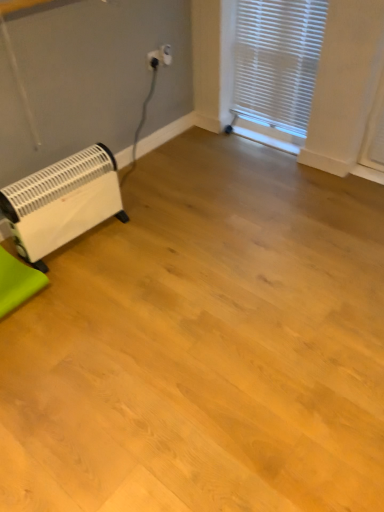
Question: Does green fabric at lower left turn towards white plastic heater at lower left?

Choices:
 (A) no
 (B) yes

Answer: (A)

Question: Does green fabric at lower left have a lesser width compared to white plastic heater at lower left?

Choices:
 (A) no
 (B) yes

Answer: (A)

Question: Is white plastic heater at lower left at the back of green fabric at lower left?

Choices:
 (A) no
 (B) yes

Answer: (A)

Question: From the image's perspective, would you say green fabric at lower left is shown under white plastic heater at lower left?

Choices:
 (A) yes
 (B) no

Answer: (A)

Question: Is green fabric at lower left placed right next to white plastic heater at lower left?

Choices:
 (A) yes
 (B) no

Answer: (B)

Question: In the image, is green fabric at lower left positioned in front of or behind white plastic blinds at upper right?

Choices:
 (A) behind
 (B) front

Answer: (B)

Question: From a real-world perspective, is green fabric at lower left above or below white plastic blinds at upper right?

Choices:
 (A) above
 (B) below

Answer: (B)

Question: Is point (29, 295) positioned closer to the camera than point (238, 60)?

Choices:
 (A) closer
 (B) farther

Answer: (A)

Question: From the image's perspective, relative to white plastic blinds at upper right, is green fabric at lower left above or below?

Choices:
 (A) below
 (B) above

Answer: (A)

Question: In terms of height, does green fabric at lower left look taller or shorter compared to white plastic heater at lower left?

Choices:
 (A) tall
 (B) short

Answer: (B)

Question: Based on their sizes in the image, would you say green fabric at lower left is bigger or smaller than white plastic heater at lower left?

Choices:
 (A) big
 (B) small

Answer: (B)

Question: In terms of width, does green fabric at lower left look wider or thinner when compared to white plastic heater at lower left?

Choices:
 (A) wide
 (B) thin

Answer: (A)

Question: From a real-world perspective, relative to white plastic heater at lower left, is green fabric at lower left vertically above or below?

Choices:
 (A) below
 (B) above

Answer: (A)

Question: Relative to green fabric at lower left, is white plastic electric outlet at upper center in front or behind?

Choices:
 (A) front
 (B) behind

Answer: (B)

Question: Considering the positions of white plastic electric outlet at upper center and green fabric at lower left in the image, is white plastic electric outlet at upper center taller or shorter than green fabric at lower left?

Choices:
 (A) tall
 (B) short

Answer: (A)